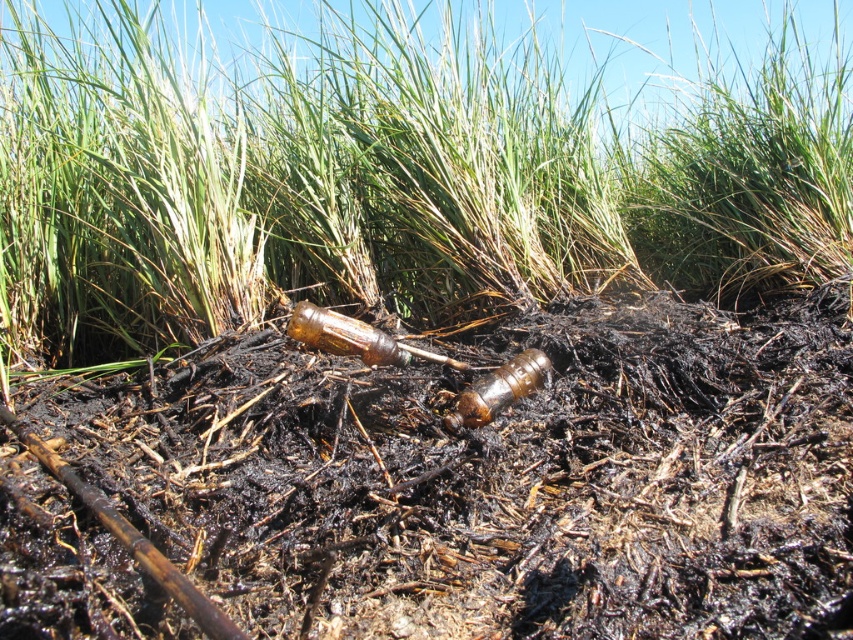
Is brown charred dirt at center smaller than green grass at center?

Actually, brown charred dirt at center might be larger than green grass at center.

Is point (332, 625) behind point (1, 38)?

That is False.

Between point (834, 493) and point (369, 13), which one is positioned in front?

Point (834, 493)

Locate an element on the screen. The width and height of the screenshot is (853, 640). brown charred dirt at center is located at coordinates (498, 477).